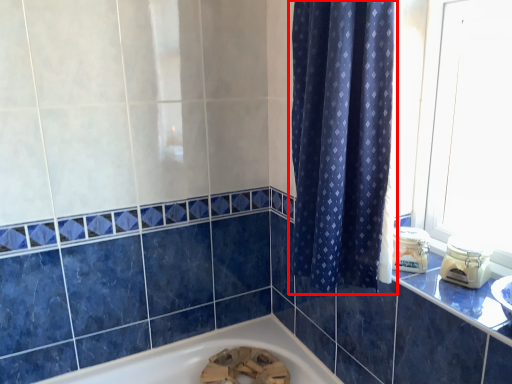
Question: Where is curtain (annotated by the red box) located in relation to counter top in the image?

Choices:
 (A) right
 (B) left

Answer: (B)